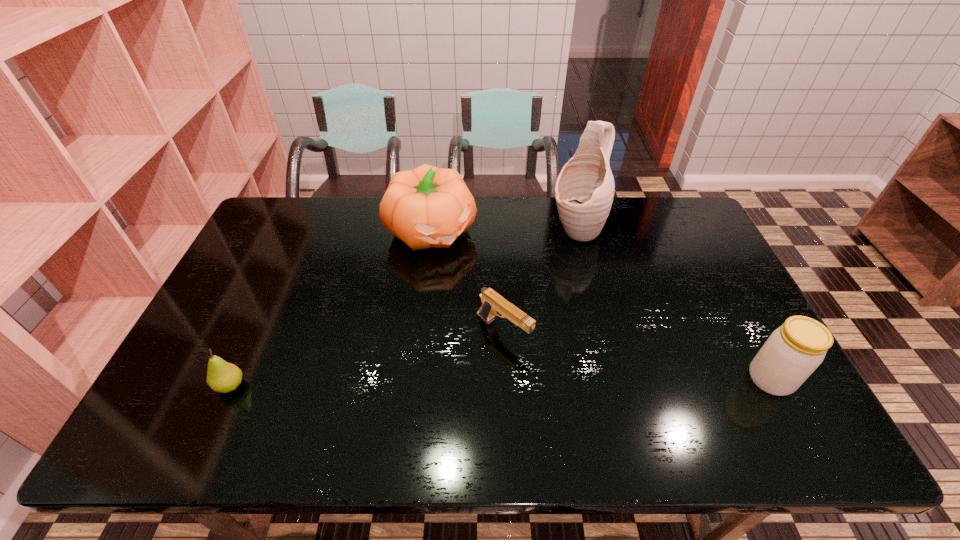
In the image, there is a desktop. In order to click on vacant space at the left edge in this screenshot , I will do `click(282, 269)`.

Where is `free spot at the right edge of the desktop`? The image size is (960, 540). free spot at the right edge of the desktop is located at coordinates (735, 294).

This screenshot has width=960, height=540. Find the location of `free area in between the tallest object and the pear`. free area in between the tallest object and the pear is located at coordinates (403, 308).

Image resolution: width=960 pixels, height=540 pixels. Find the location of `unoccupied position between the leftmost object and the second object from left to right`. unoccupied position between the leftmost object and the second object from left to right is located at coordinates pyautogui.click(x=331, y=307).

Where is `vacant region between the third farthest object and the leftmost object`? The image size is (960, 540). vacant region between the third farthest object and the leftmost object is located at coordinates (367, 359).

This screenshot has height=540, width=960. What are the coordinates of `blank region between the pistol and the rightmost object` in the screenshot? It's located at (637, 355).

The image size is (960, 540). In order to click on vacant area between the third shortest object and the third object from right to left in this screenshot , I will do `click(637, 355)`.

Locate an element on the screen. Image resolution: width=960 pixels, height=540 pixels. free space between the pear and the pitcher is located at coordinates (403, 308).

The image size is (960, 540). Find the location of `vacant area between the leftmost object and the tallest object`. vacant area between the leftmost object and the tallest object is located at coordinates (403, 308).

Find the location of `vacant space in between the leftmost object and the second object from left to right`. vacant space in between the leftmost object and the second object from left to right is located at coordinates point(331,307).